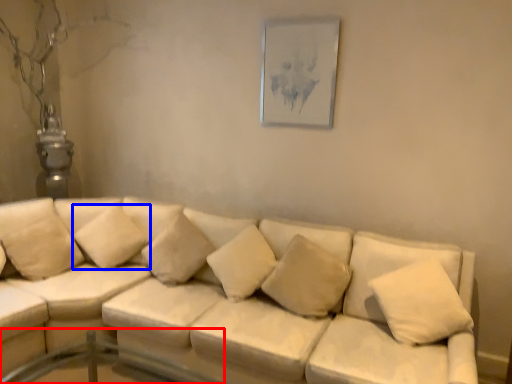
Question: Among these objects, which one is farthest to the camera, glass table (highlighted by a red box) or pillow (highlighted by a blue box)?

Choices:
 (A) glass table
 (B) pillow

Answer: (B)